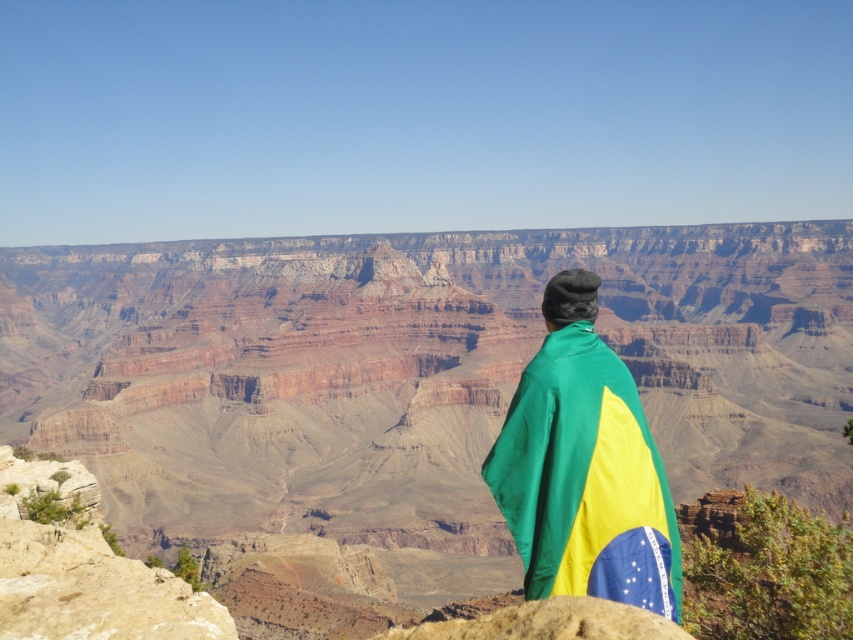
Can you confirm if brown rocky canyon at center is thinner than green/yellow fabric draped at center?

In fact, brown rocky canyon at center might be wider than green/yellow fabric draped at center.

Between point (335, 244) and point (669, 579), which one is positioned behind?

Point (335, 244)

Locate an element on the screen. This screenshot has width=853, height=640. brown rocky canyon at center is located at coordinates (408, 387).